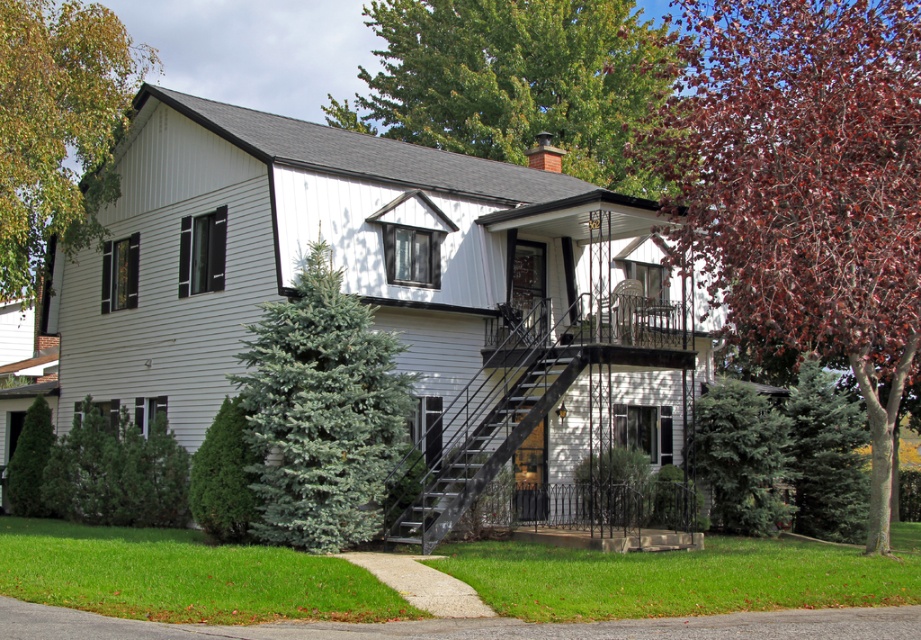
You are standing in front of the house and want to enter through the front door. Which object, the green leafy tree at upper left or the black metal staircase at center, would you need to pass by first?

You would need to pass by the green leafy tree at upper left first because it is closer to you than the black metal staircase at center.

You are standing on the front porch of the house and looking towards the green leafy tree at upper center and the green textured evergreen tree at center. Which tree appears higher up in your view?

The green leafy tree at upper center appears higher up in your view because it is located above the green textured evergreen tree at center.

You are standing in front of the house and see two points marked on the image. Which point is closer to you, point (x=109, y=195) or point (x=572, y=365)?

Point (x=109, y=195) is closer to you because it is further to the camera than point (x=572, y=365).